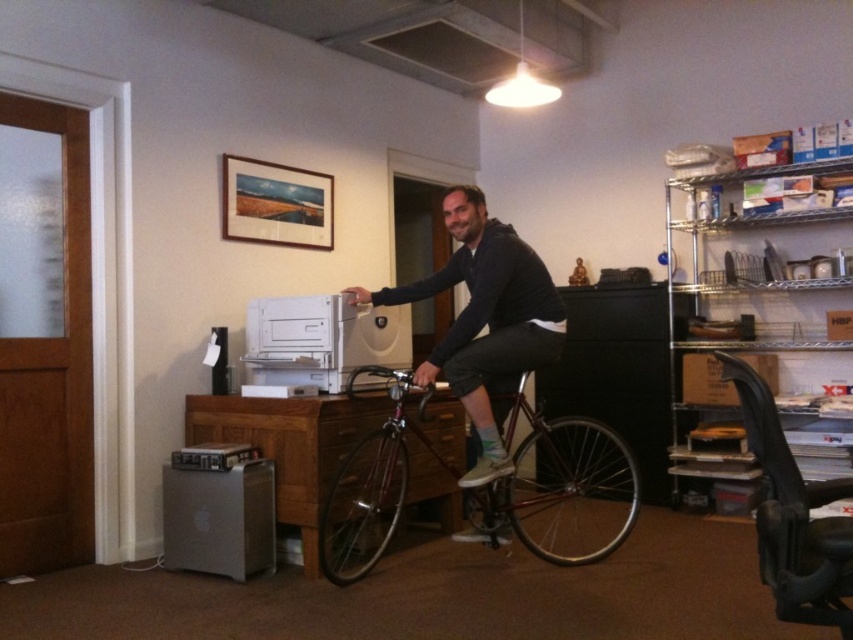
Between shiny metallic bicycle at center and sleek silver computer at lower left, which one appears on the left side from the viewer's perspective?

sleek silver computer at lower left is more to the left.

Based on the photo, is shiny metallic bicycle at center taller than sleek silver computer at lower left?

Correct, shiny metallic bicycle at center is much taller as sleek silver computer at lower left.

Which is in front, point (352, 492) or point (209, 518)?

Point (209, 518) is in front.

Find the location of `shiny metallic bicycle at center`. shiny metallic bicycle at center is located at coordinates (563, 481).

Which of these two, matte black bicycle at center or sleek silver computer at lower left, stands taller?

Standing taller between the two is matte black bicycle at center.

Is matte black bicycle at center to the right of sleek silver computer at lower left from the viewer's perspective?

Indeed, matte black bicycle at center is positioned on the right side of sleek silver computer at lower left.

Who is more forward, [534,292] or [247,561]?

Positioned in front is point [247,561].

Locate an element on the screen. This screenshot has width=853, height=640. matte black bicycle at center is located at coordinates (485, 320).

Between shiny metallic bicycle at center and matte black bicycle at center, which one has less height?

shiny metallic bicycle at center is shorter.

Is point (604, 545) behind point (495, 240)?

Yes, it is.

This screenshot has height=640, width=853. Find the location of `shiny metallic bicycle at center`. shiny metallic bicycle at center is located at coordinates (563, 481).